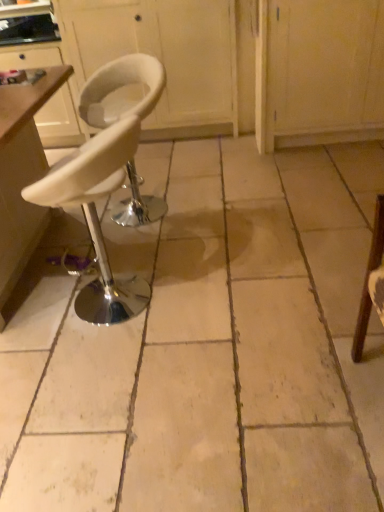
At what (x,y) coordinates should I click in order to perform the action: click on free point below white plastic table at left (from a real-world perspective). Please return your answer as a coordinate pair (x, y). Looking at the image, I should click on (45, 266).